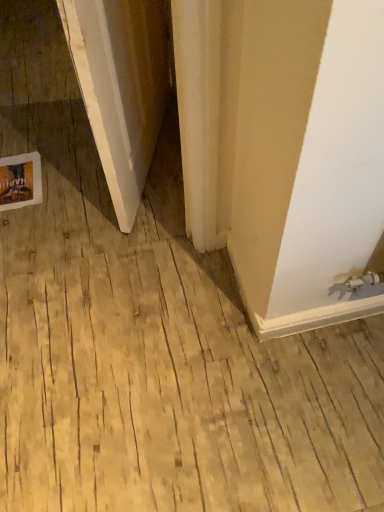
Where is `white cardboard postcard at lower left`? The image size is (384, 512). white cardboard postcard at lower left is located at coordinates (20, 181).

The height and width of the screenshot is (512, 384). Describe the element at coordinates (20, 181) in the screenshot. I see `white cardboard postcard at lower left` at that location.

Locate an element on the screen. The image size is (384, 512). white cardboard postcard at lower left is located at coordinates (20, 181).